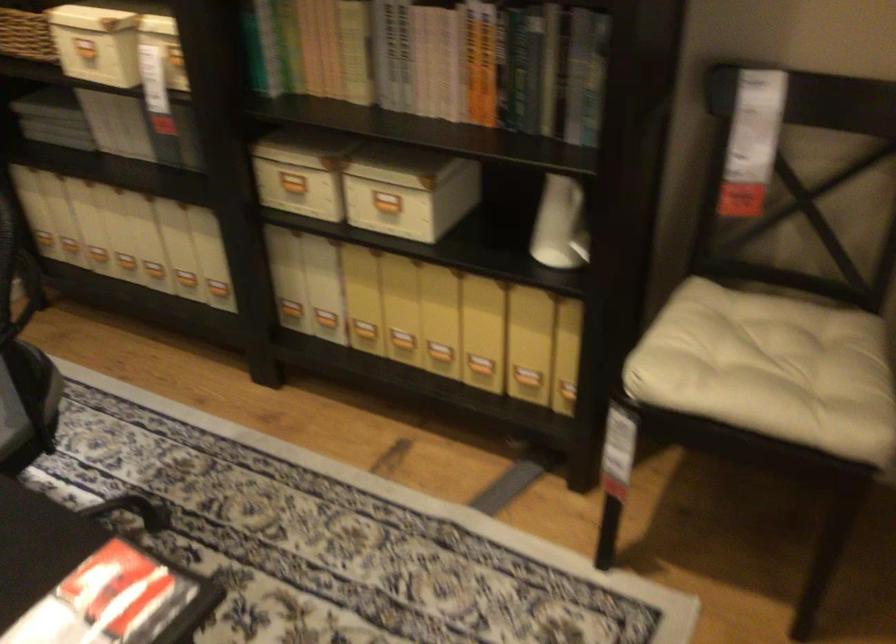
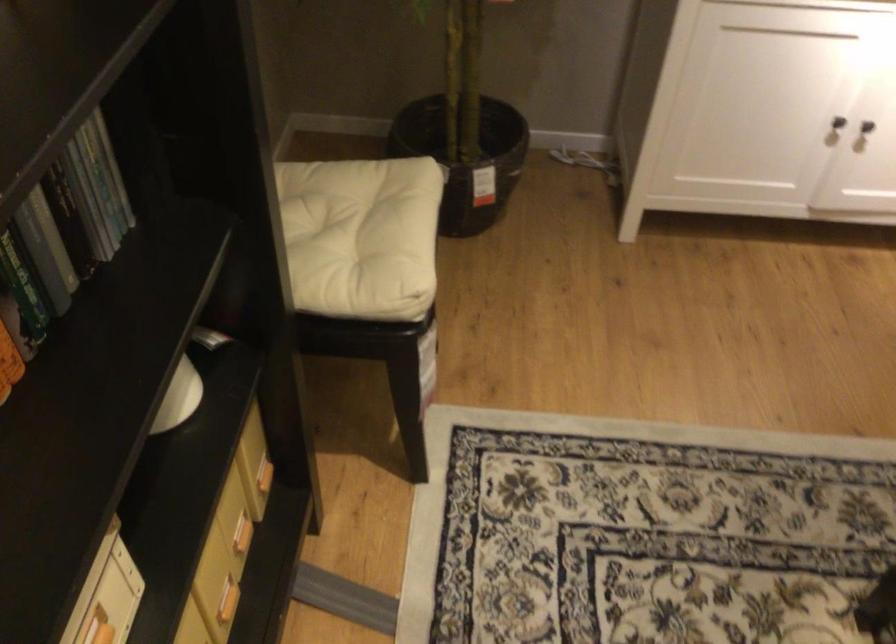
Where in the second image is the point corresponding to point 782,373 from the first image?

(355, 234)